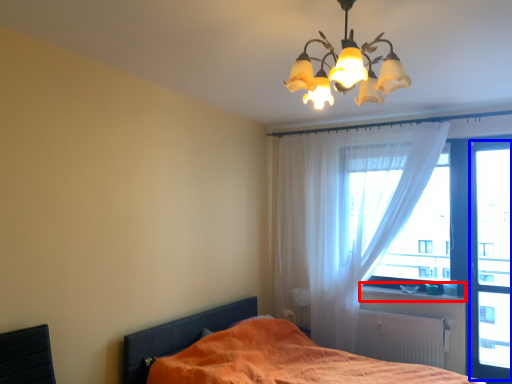
Question: Which object appears closest to the camera in this image, window sill (highlighted by a red box) or window screen (highlighted by a blue box)?

Choices:
 (A) window sill
 (B) window screen

Answer: (B)